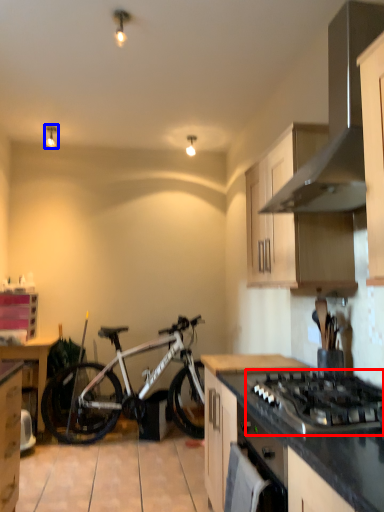
Question: Which object is further to the camera taking this photo, gas stove (highlighted by a red box) or light fixture (highlighted by a blue box)?

Choices:
 (A) gas stove
 (B) light fixture

Answer: (B)